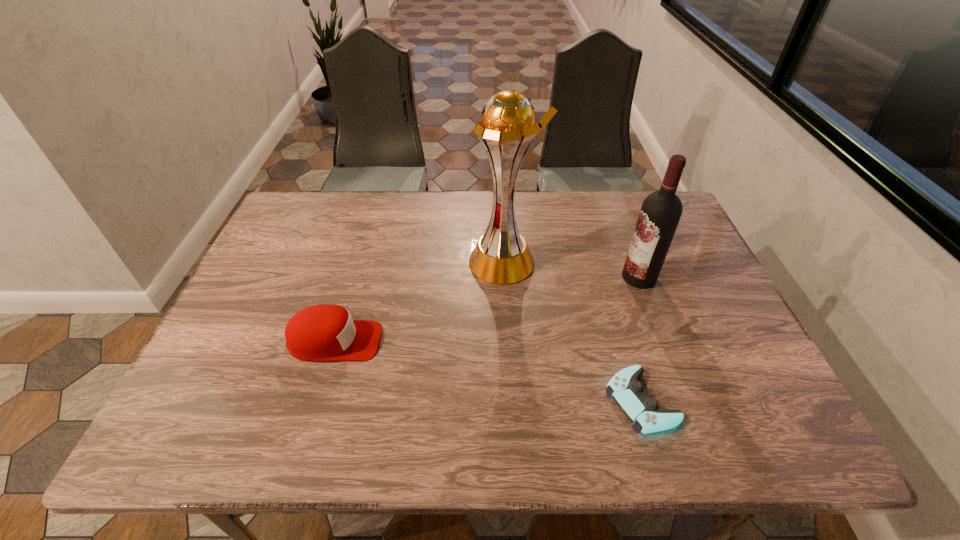
The height and width of the screenshot is (540, 960). Find the location of `trophy`. trophy is located at coordinates (501, 256).

Locate an element on the screen. The height and width of the screenshot is (540, 960). the third object from right to left is located at coordinates (501, 256).

The height and width of the screenshot is (540, 960). Identify the location of the third shortest object. (661, 211).

Identify the location of the second shortest object. (325, 332).

Where is `the leftmost object`? This screenshot has width=960, height=540. the leftmost object is located at coordinates (325, 332).

Find the location of `the shortest object`. the shortest object is located at coordinates (628, 393).

Identify the location of control. Image resolution: width=960 pixels, height=540 pixels. (628, 393).

The width and height of the screenshot is (960, 540). Find the location of `vacant point located 0.200m on the front-facing side of the trophy`. vacant point located 0.200m on the front-facing side of the trophy is located at coordinates (397, 261).

At what (x,y) coordinates should I click in order to perform the action: click on free space located on the front-facing side of the trophy. Please return your answer as a coordinate pair (x, y). Image resolution: width=960 pixels, height=540 pixels. Looking at the image, I should click on (405, 261).

The image size is (960, 540). What are the coordinates of `free space located on the front-facing side of the trophy` in the screenshot? It's located at (x=451, y=261).